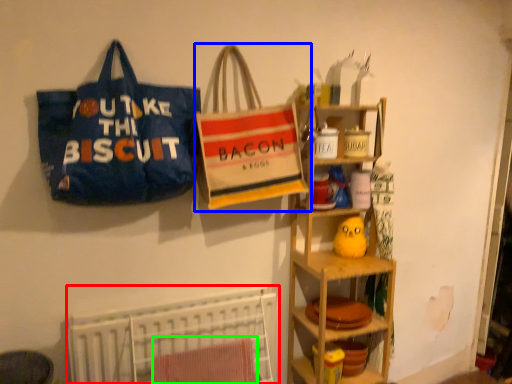
Question: Considering the real-world distances, which object is closest to bed (highlighted by a red box)? handbag (highlighted by a blue box) or beach towel (highlighted by a green box).

Choices:
 (A) handbag
 (B) beach towel

Answer: (B)